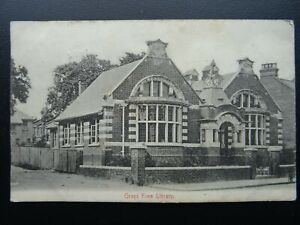
Locate an element on the screen. This screenshot has height=225, width=300. picture is located at coordinates (159, 127).